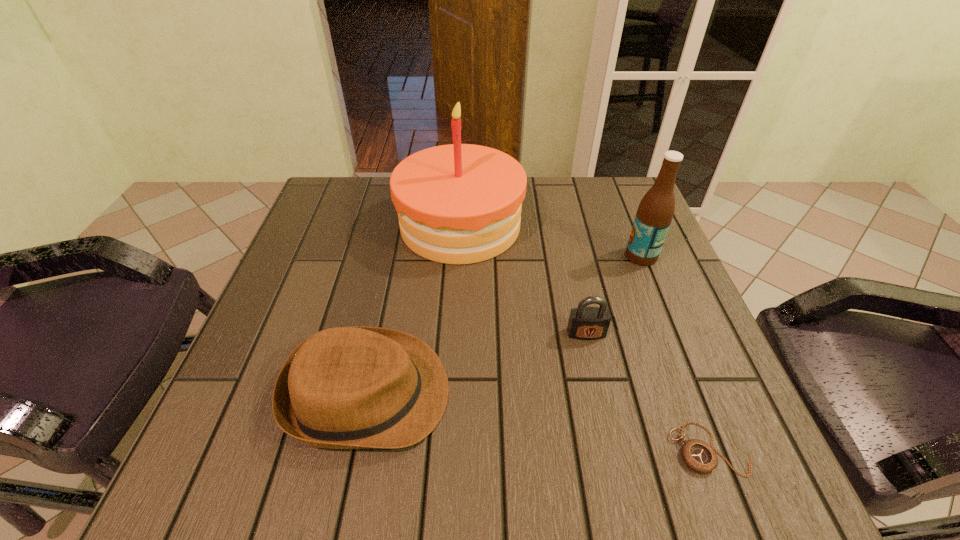
The width and height of the screenshot is (960, 540). Identify the location of the tallest object. (459, 203).

Locate an element on the screen. This screenshot has height=540, width=960. beer bottle is located at coordinates (655, 212).

The height and width of the screenshot is (540, 960). Find the location of `padlock`. padlock is located at coordinates (585, 323).

The width and height of the screenshot is (960, 540). In order to click on fedora in this screenshot , I will do `click(346, 387)`.

In order to click on the shortest object in this screenshot , I will do `click(699, 456)`.

I want to click on vacant space located 0.240m on the right of the tallest object, so click(x=619, y=225).

You are a GUI agent. You are given a task and a screenshot of the screen. Output one action in this format:
    pyautogui.click(x=<x>, y=<y>)
    Task: Click on the vacant area situated on the left of the fourth shortest object
    The width and height of the screenshot is (960, 540).
    Given the screenshot: What is the action you would take?
    pyautogui.click(x=599, y=256)

Where is `free space located on the front of the third object from right to left near the keyhole`? free space located on the front of the third object from right to left near the keyhole is located at coordinates point(598,387).

Identify the location of free location located on the front-facing side of the fedora. The height and width of the screenshot is (540, 960). (681, 393).

You are a GUI agent. You are given a task and a screenshot of the screen. Output one action in this format:
    pyautogui.click(x=<x>, y=<y>)
    Task: Click on the vacant space located on the left of the pocket watch
    The width and height of the screenshot is (960, 540).
    Given the screenshot: What is the action you would take?
    pyautogui.click(x=544, y=449)